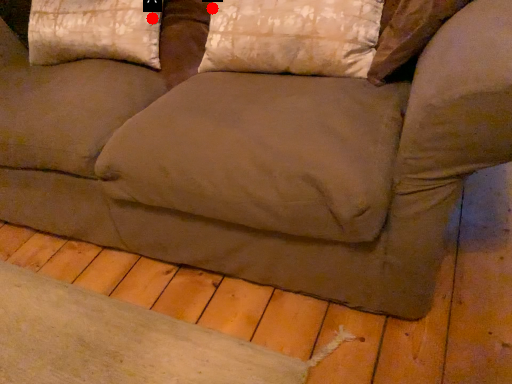
Question: Two points are circled on the image, labeled by A and B beside each circle. Which point is closer to the camera?

Choices:
 (A) A is closer
 (B) B is closer

Answer: (B)